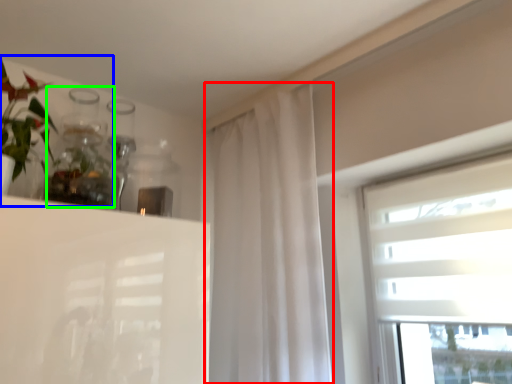
Question: Considering the real-world distances, which object is farthest from curtain (highlighted by a red box)? floral arrangement (highlighted by a blue box) or glass vase (highlighted by a green box)?

Choices:
 (A) floral arrangement
 (B) glass vase

Answer: (A)